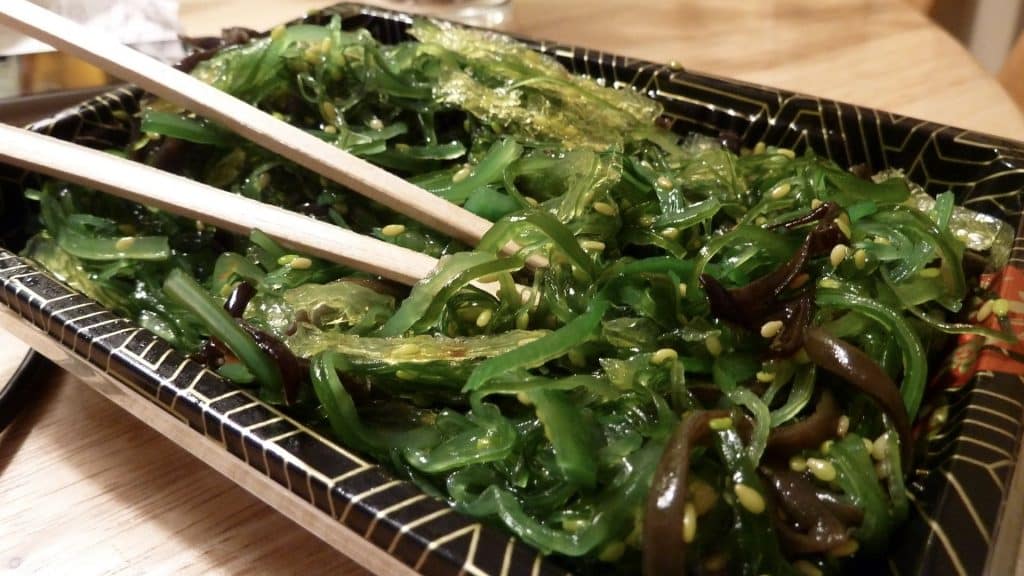
Where is `flat surfaces`? The image size is (1024, 576). flat surfaces is located at coordinates point(811,45), point(117,510), point(243,408), point(834,104), point(1002,415), point(82,104), point(167,72), point(127,169), point(134,81).